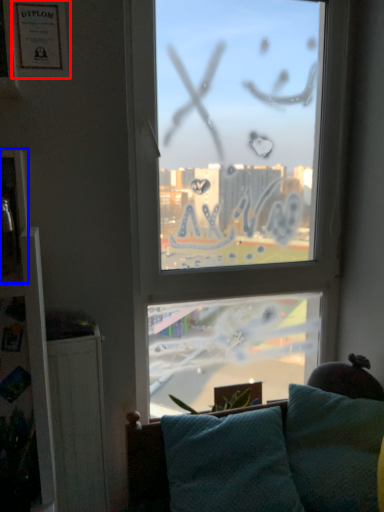
Question: Which object appears farthest to the camera in this image, picture frame (highlighted by a red box) or picture frame (highlighted by a blue box)?

Choices:
 (A) picture frame
 (B) picture frame

Answer: (A)